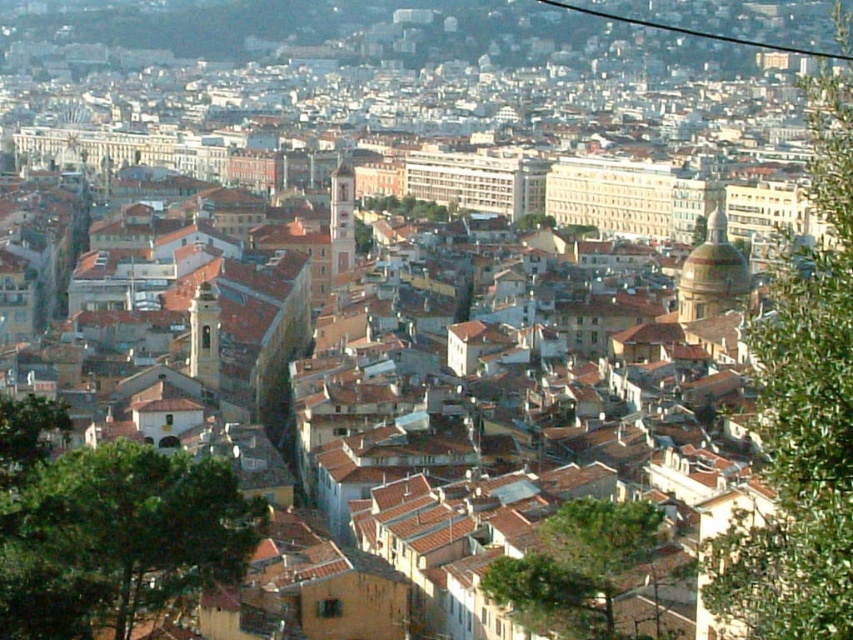
Question: Which object appears farthest from the camera in this image?

Choices:
 (A) green leafy tree at right
 (B) green leafy tree at lower left

Answer: (B)

Question: Does green leafy tree at right lie behind green leafy tree at lower left?

Choices:
 (A) no
 (B) yes

Answer: (A)

Question: Is green leafy tree at right closer to the viewer compared to green leafy tree at center?

Choices:
 (A) yes
 (B) no

Answer: (A)

Question: Which point appears farthest from the camera in this image?

Choices:
 (A) (492, 566)
 (B) (9, 506)
 (C) (845, 339)

Answer: (A)

Question: Based on their relative distances, which object is nearer to the green leafy tree at center?

Choices:
 (A) green leafy tree at right
 (B) green leafy tree at lower left

Answer: (A)

Question: Is green leafy tree at lower left below green leafy tree at center?

Choices:
 (A) no
 (B) yes

Answer: (A)